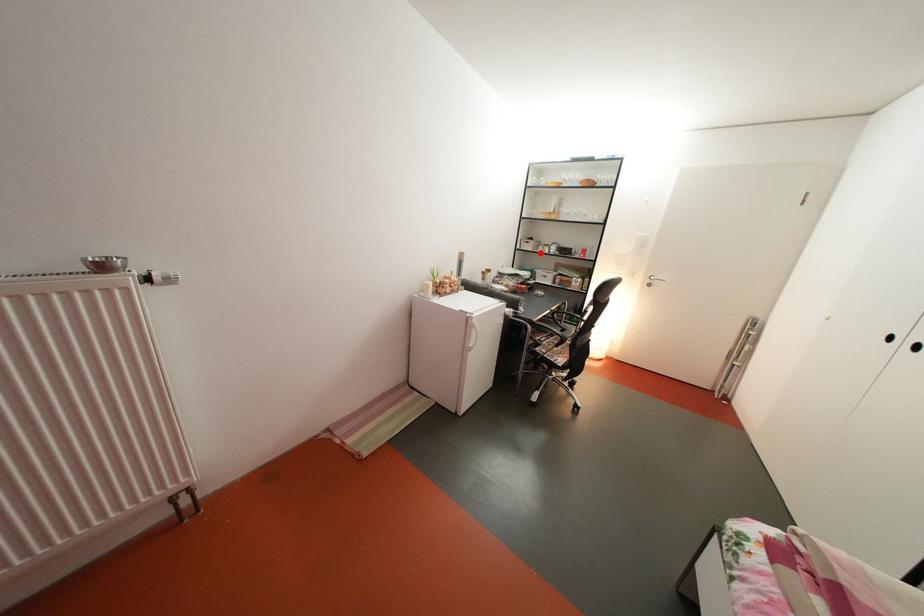
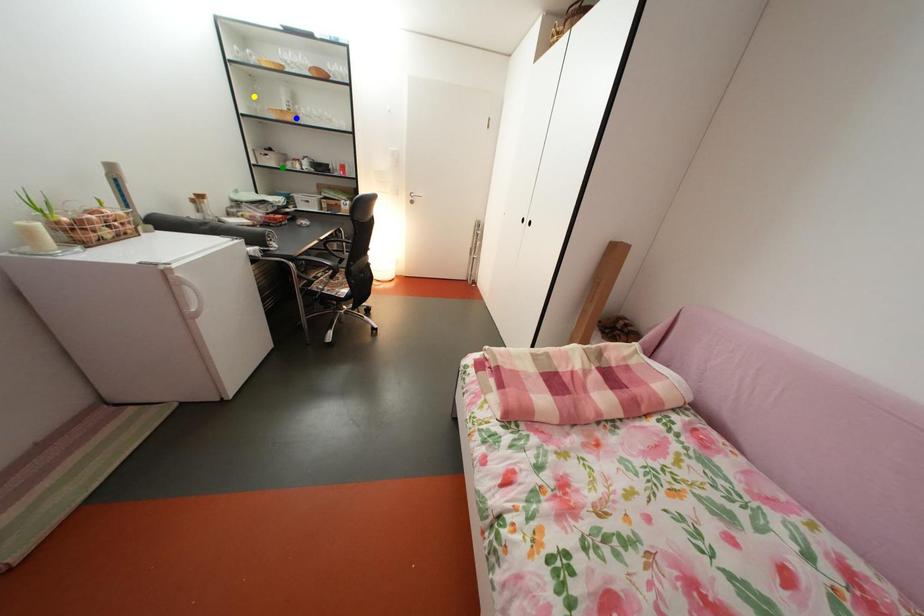
Question: I am providing you with two images of the same scene from different viewpoints. A red point is marked on the first image. You are given multiple points on the second image. Which spot in image 2 lines up with the point in image 1?

Choices:
 (A) blue point
 (B) green point
 (C) yellow point

Answer: (B)